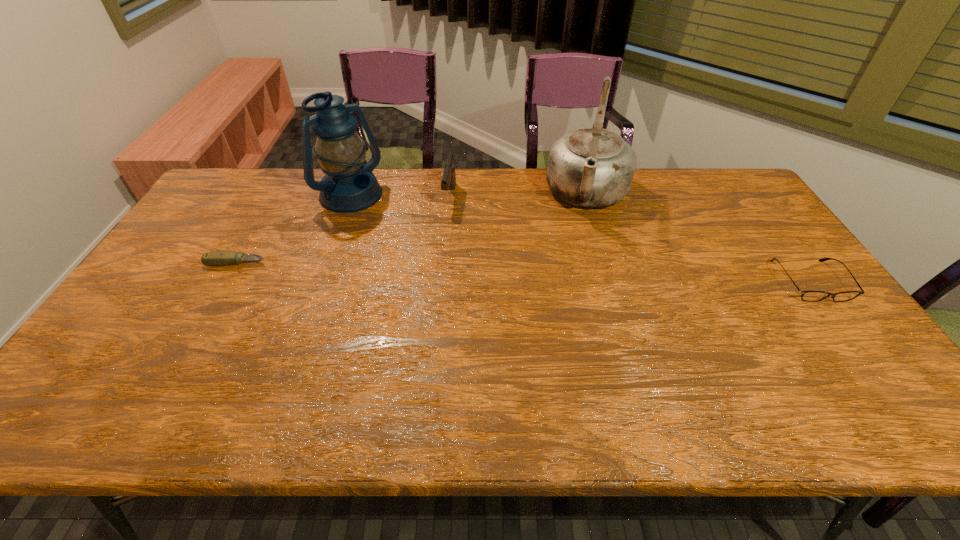
At what (x,y) coordinates should I click in order to perform the action: click on the second closest object to the rightmost object. Please return your answer as a coordinate pair (x, y). Looking at the image, I should click on (448, 182).

In order to click on object that stands as the third closest to the shortest object in this screenshot , I will do `click(593, 167)`.

Find the location of a particular element. free space in the image that satisfies the following two spatial constraints: 1. on the back side of the kettle; 2. on the right side of the pistol is located at coordinates (450, 194).